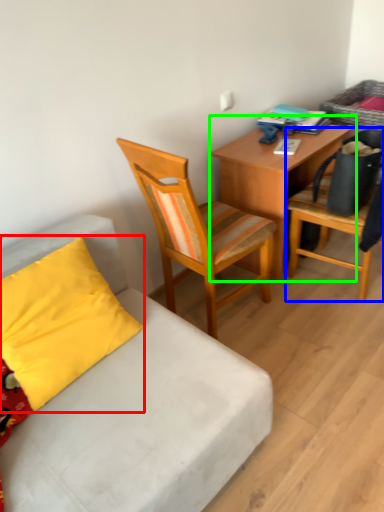
Question: Considering the real-world distances, which object is closest to pillow (highlighted by a red box)? chair (highlighted by a blue box) or desk (highlighted by a green box).

Choices:
 (A) chair
 (B) desk

Answer: (B)